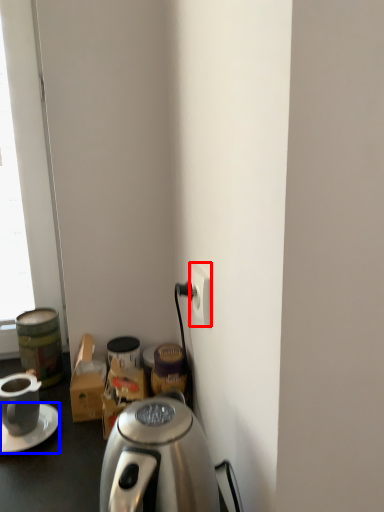
Question: Which object is further to the camera taking this photo, power outlet (highlighted by a red box) or saucer (highlighted by a blue box)?

Choices:
 (A) power outlet
 (B) saucer

Answer: (B)